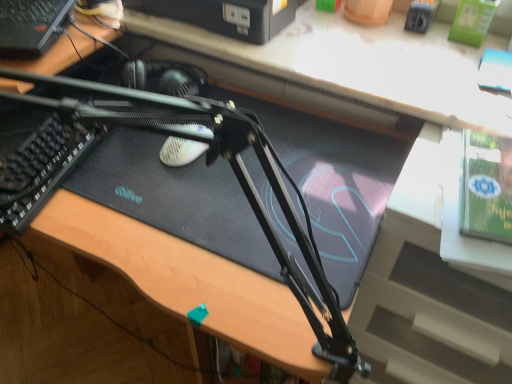
Locate an element on the screen. The height and width of the screenshot is (384, 512). free space to the right of black plastic printer at upper center, the first computer positioned from the right is located at coordinates (361, 42).